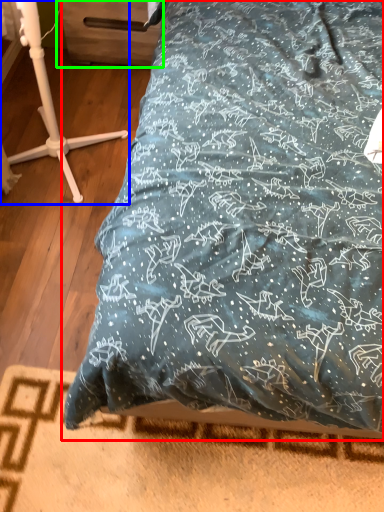
Question: Considering the real-world distances, which object is farthest from bed (highlighted by a red box)? furniture (highlighted by a blue box) or drawer (highlighted by a green box)?

Choices:
 (A) furniture
 (B) drawer

Answer: (B)